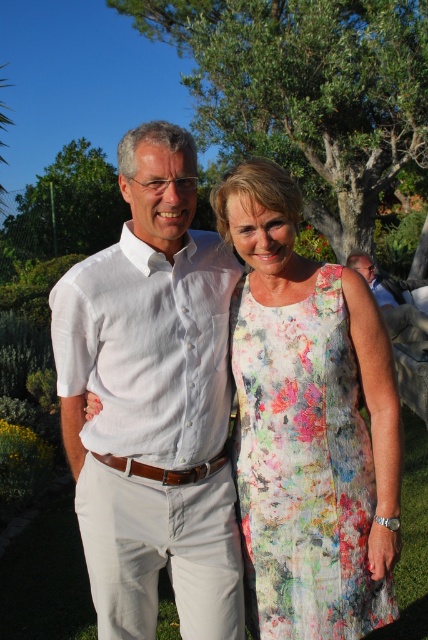
Question: Is floral printed fabric dress at center behind matte brown leather belt at lower right?

Choices:
 (A) yes
 (B) no

Answer: (B)

Question: Among these points, which one is nearest to the camera?

Choices:
 (A) (136, 275)
 (B) (264, 579)

Answer: (B)

Question: Is white linen shirt at center closer to the viewer compared to floral printed fabric dress at center?

Choices:
 (A) yes
 (B) no

Answer: (B)

Question: Is white linen shirt at center positioned behind matte brown leather belt at lower right?

Choices:
 (A) yes
 (B) no

Answer: (B)

Question: Among these points, which one is nearest to the camera?

Choices:
 (A) (418, 324)
 (B) (234, 512)
 (C) (267, 552)

Answer: (C)

Question: Which object is the closest to the white linen shirt at center?

Choices:
 (A) matte brown leather belt at lower right
 (B) floral printed fabric dress at center

Answer: (B)